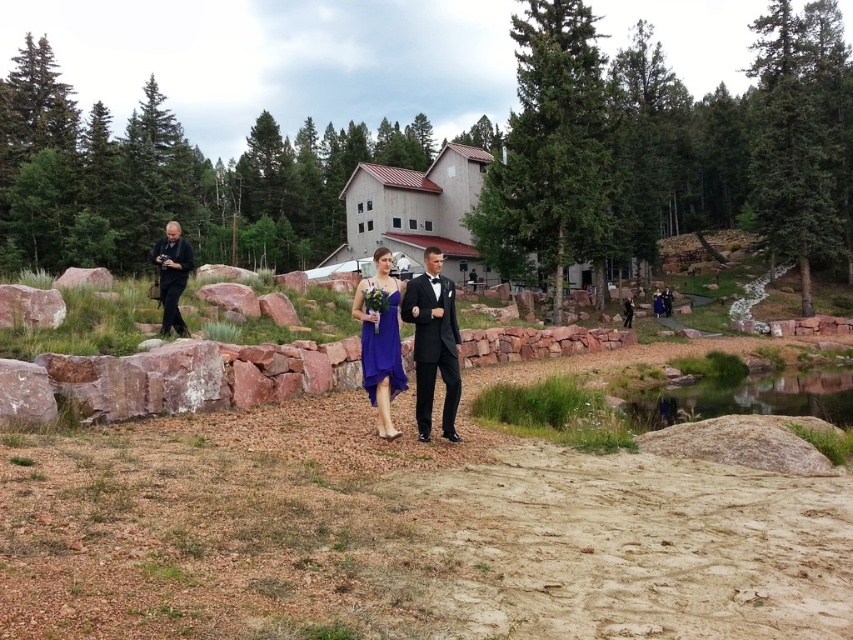
Between clear water at lower right and shiny black suit at center, which one is positioned higher?

shiny black suit at center

Can you confirm if clear water at lower right is wider than shiny black suit at center?

Indeed, clear water at lower right has a greater width compared to shiny black suit at center.

Is point (662, 397) positioned in front of point (428, 380)?

No, (662, 397) is further to viewer.

Locate an element on the screen. clear water at lower right is located at coordinates (747, 397).

This screenshot has width=853, height=640. Identify the location of satin blue dress at center. (381, 349).

Does point (395, 312) lie in front of point (664, 285)?

Yes, it is.

This screenshot has height=640, width=853. What are the coordinates of `satin blue dress at center` in the screenshot? It's located at (381, 349).

Looking at this image, does clear water at lower right appear over satin blue dress at center?

Actually, clear water at lower right is below satin blue dress at center.

Between clear water at lower right and satin blue dress at center, which one has more height?

With more height is satin blue dress at center.

Who is more forward, (697, 392) or (393, 301)?

Point (393, 301)

Locate an element on the screen. This screenshot has width=853, height=640. clear water at lower right is located at coordinates (747, 397).